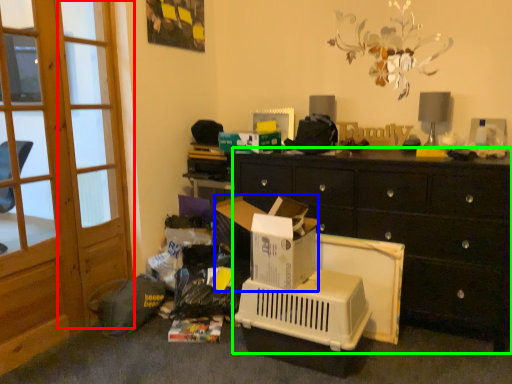
Question: Considering the real-world distances, which object is closest to screen door (highlighted by a red box)? cardboard box (highlighted by a blue box) or cabinetry (highlighted by a green box).

Choices:
 (A) cardboard box
 (B) cabinetry

Answer: (A)